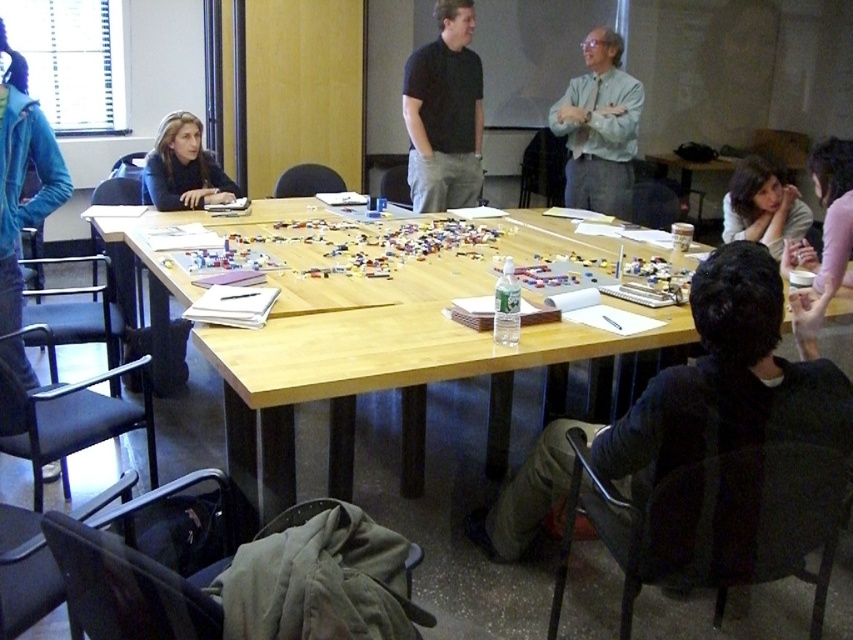
Question: Which point appears farthest from the camera in this image?

Choices:
 (A) (469, 116)
 (B) (155, 189)
 (C) (351, 403)
 (D) (596, 86)

Answer: (D)

Question: Is black cotton shirt at center to the right of light blue shirt at center from the viewer's perspective?

Choices:
 (A) no
 (B) yes

Answer: (A)

Question: Is light blue shirt at center wider than matte black jacket at upper left?

Choices:
 (A) yes
 (B) no

Answer: (B)

Question: Is the position of dark gray fabric jacket at lower right more distant than that of light blue shirt at center?

Choices:
 (A) no
 (B) yes

Answer: (A)

Question: Which point is closer to the camera taking this photo?

Choices:
 (A) (416, 93)
 (B) (845, 428)
 (C) (741, 225)
 (D) (595, 339)

Answer: (B)

Question: Which is nearer to the black cotton shirt at center?

Choices:
 (A) matte black jacket at upper left
 (B) dark gray fabric jacket at lower right

Answer: (A)